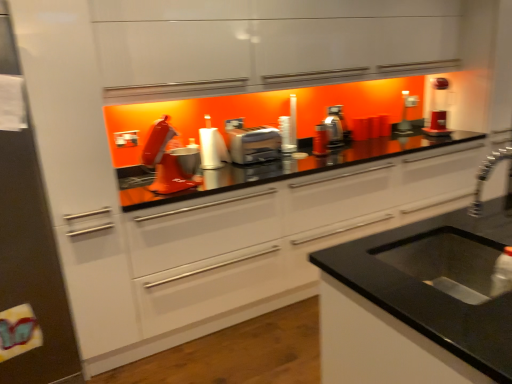
Question: In terms of size, does matte white toaster at center appear bigger or smaller than black granite sink at lower right?

Choices:
 (A) small
 (B) big

Answer: (A)

Question: From the image's perspective, is matte white toaster at center above or below black granite sink at lower right?

Choices:
 (A) above
 (B) below

Answer: (A)

Question: Which of these objects is positioned farthest from the matte red mixer at center, placed as the second appliance when sorted from right to left?

Choices:
 (A) white matte refrigerator at left
 (B) metallic silver toaster at center, the 1th appliance in the top-to-bottom sequence
 (C) matte red coffee maker at upper right
 (D) matte white toaster at center
 (E) black granite sink at lower right

Answer: (C)

Question: Which object is the farthest from the matte white toaster at center?

Choices:
 (A) metallic silver toaster at center, which is the 2th appliance from front to back
 (B) white matte refrigerator at left
 (C) matte red coffee maker at upper right
 (D) black granite sink at lower right
 (E) matte red mixer at center, the second appliance viewed from the top

Answer: (C)